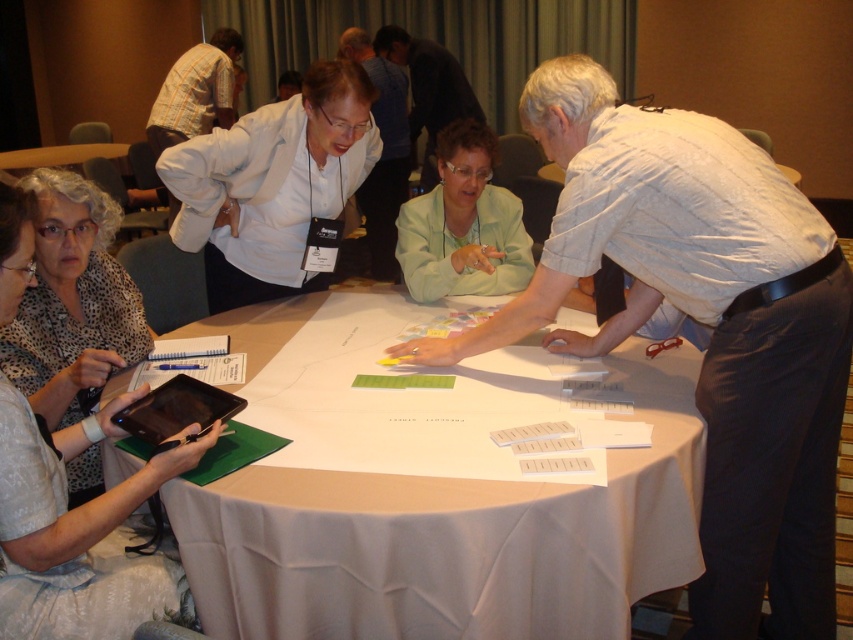
In the scene shown: You are a photographer standing behind the white striped shirt at upper right and the black glossy tablet at lower left. You want to take a photo that includes both objects in the frame. Which object should you position closer to the camera to ensure both are visible without cropping?

The white striped shirt at upper right is above the black glossy tablet at lower left. To include both in the frame without cropping, position the white striped shirt at upper right closer to the camera since it is already above the tablet and adjusting its position can help frame both effectively.

You are a photographer taking a picture of the scene. The white striped shirt at upper right and the white paper at center are both in your frame. If you want to ensure both are fully visible without cropping, which object should you focus on to maintain their proportions?

The white striped shirt at upper right is narrower than the white paper at center, so focusing on the white paper at center would help maintain proportions as it is wider and requires more space in the frame.